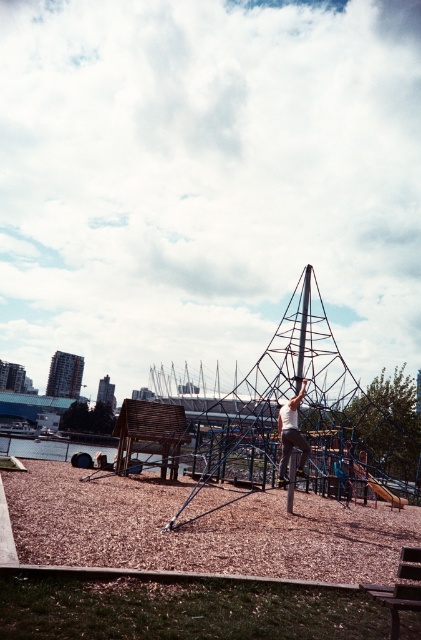
Question: Which of the following is the closest to the observer?

Choices:
 (A) (279, 433)
 (B) (376, 584)

Answer: (B)

Question: Which of the following is the closest to the observer?

Choices:
 (A) white matte shirt at center
 (B) wooden park bench at lower right

Answer: (B)

Question: Observing the image, what is the correct spatial positioning of wooden park bench at lower right in reference to white matte shirt at center?

Choices:
 (A) left
 (B) right

Answer: (B)

Question: Is wooden park bench at lower right behind white matte shirt at center?

Choices:
 (A) yes
 (B) no

Answer: (B)

Question: Does wooden park bench at lower right appear on the left side of white matte shirt at center?

Choices:
 (A) no
 (B) yes

Answer: (A)